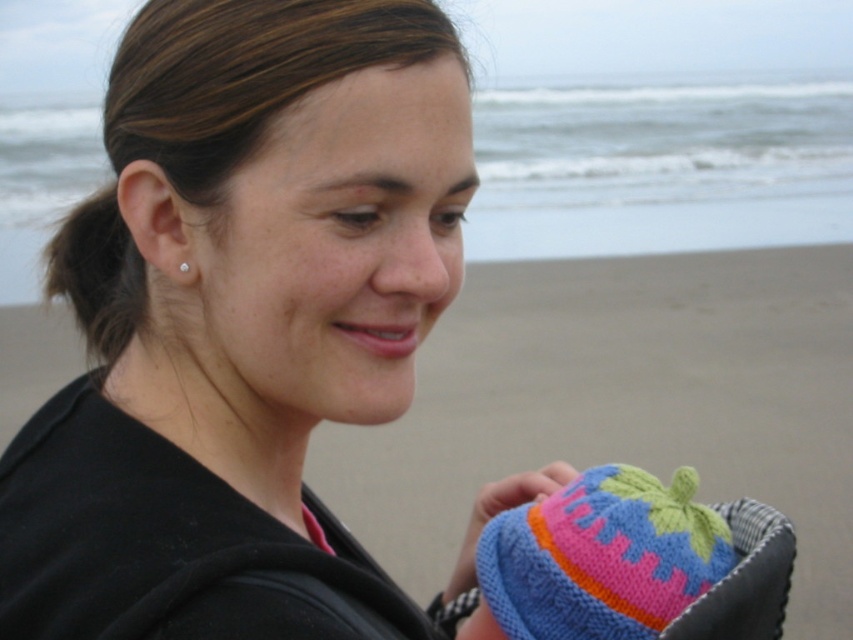
Question: Which point is closer to the camera?

Choices:
 (A) knitted fabric baby hat at lower right
 (B) sandy beach at lower right
 (C) black fabric at center
 (D) knitted wool hat at lower right

Answer: (C)

Question: Which point is farther to the camera?

Choices:
 (A) knitted wool hat at lower right
 (B) knitted fabric baby hat at lower right

Answer: (B)

Question: Estimate the real-world distances between objects in this image. Which object is closer to the sandy beach at lower right?

Choices:
 (A) knitted wool hat at lower right
 (B) pearl earring at ear

Answer: (A)

Question: Is knitted fabric baby hat at lower right in front of pearl earring at ear?

Choices:
 (A) yes
 (B) no

Answer: (B)

Question: Is knitted wool hat at lower right behind pearl earring at ear?

Choices:
 (A) no
 (B) yes

Answer: (A)

Question: Is knitted wool hat at lower right below pearl earring at ear?

Choices:
 (A) yes
 (B) no

Answer: (A)